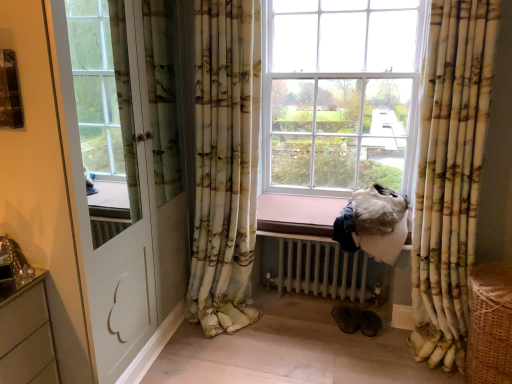
You are a GUI agent. You are given a task and a screenshot of the screen. Output one action in this format:
    pyautogui.click(x=<x>, y=<y>)
    Task: Click on the vacant region in front of floral fabric curtain at center, arranged as the 1th curtain when viewed from the left
    This screenshot has height=384, width=512.
    Given the screenshot: What is the action you would take?
    tap(224, 364)